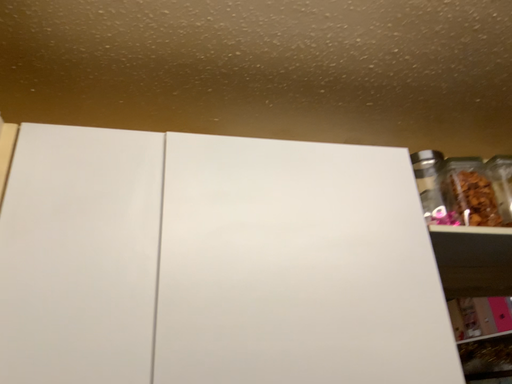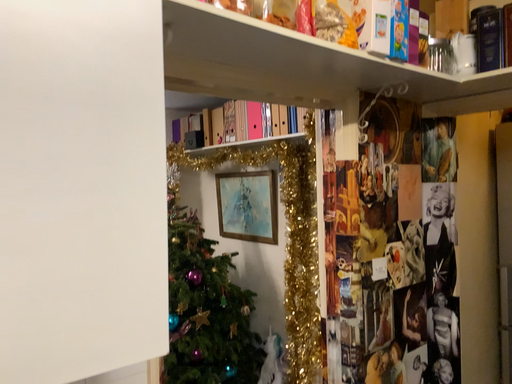
Question: Which way did the camera rotate in the video?

Choices:
 (A) rotated downward
 (B) rotated upward

Answer: (A)